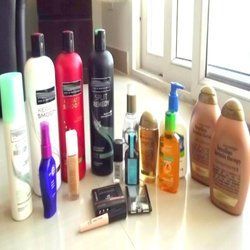
Locate an element on the screen. The width and height of the screenshot is (250, 250). blue spout like to dispense lotion is located at coordinates (175, 84).